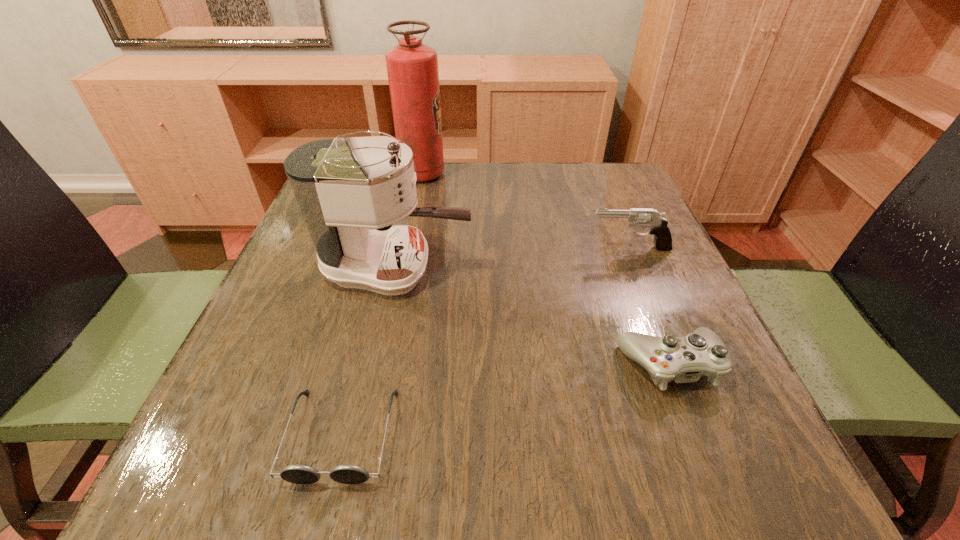
Where is `vacant space at the near edge`? This screenshot has width=960, height=540. vacant space at the near edge is located at coordinates coord(501,437).

Identify the location of vacant area at the left edge of the desktop. The image size is (960, 540). (317, 263).

You are a GUI agent. You are given a task and a screenshot of the screen. Output one action in this format:
    pyautogui.click(x=<x>, y=<y>)
    Task: Click on the vacant space at the right edge of the desktop
    Image resolution: width=960 pixels, height=540 pixels.
    Given the screenshot: What is the action you would take?
    pyautogui.click(x=662, y=322)

Where is `vacant region at the near left corner`? The height and width of the screenshot is (540, 960). vacant region at the near left corner is located at coordinates (270, 448).

Image resolution: width=960 pixels, height=540 pixels. In the image, there is a desktop. Identify the location of vacant space at the far right corner. (623, 165).

What are the coordinates of `empty space between the second tallest object and the sunglasses` in the screenshot? It's located at (369, 351).

Find the location of `vacant region between the tallest object and the fourth shortest object`. vacant region between the tallest object and the fourth shortest object is located at coordinates (409, 220).

Where is `free spot between the fire extinguisher and the control`? The height and width of the screenshot is (540, 960). free spot between the fire extinguisher and the control is located at coordinates (546, 269).

The width and height of the screenshot is (960, 540). What are the coordinates of `free space between the second tallest object and the third shortest object` in the screenshot? It's located at (513, 258).

This screenshot has width=960, height=540. In order to click on free space between the fire extinguisher and the coffee maker in this screenshot , I will do `click(409, 220)`.